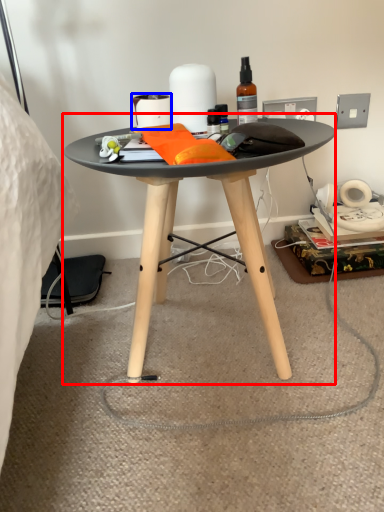
Question: Which point is further to the camera, coffee table (highlighted by a red box) or toilet paper (highlighted by a blue box)?

Choices:
 (A) coffee table
 (B) toilet paper

Answer: (B)